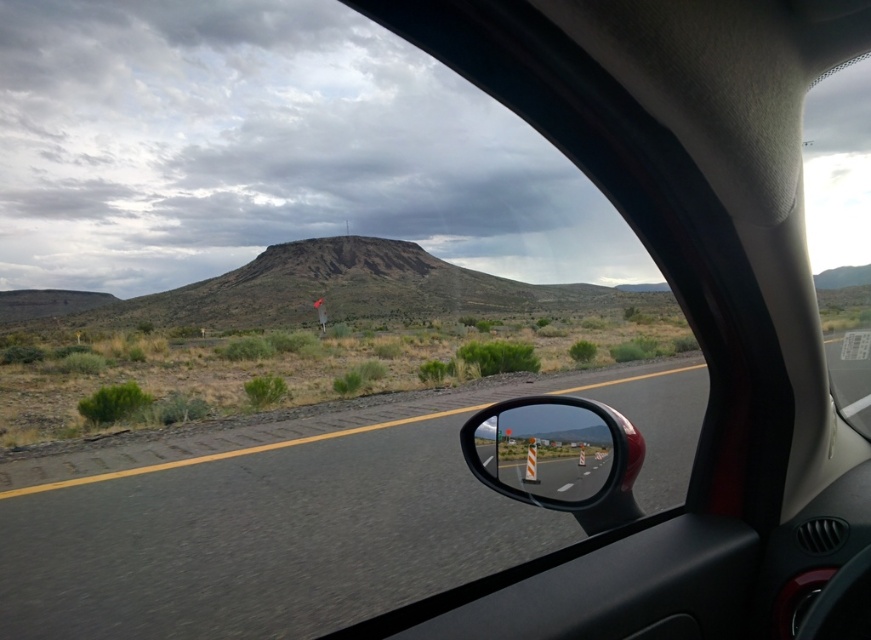
Does asphalt road at center have a smaller size compared to shiny chrome mirror at right?

Yes, asphalt road at center is smaller than shiny chrome mirror at right.

Which is above, asphalt road at center or shiny chrome mirror at right?

Positioned higher is shiny chrome mirror at right.

Between point (242, 598) and point (588, 500), which one is positioned behind?

Positioned behind is point (242, 598).

Identify the location of asphalt road at center. The width and height of the screenshot is (871, 640). [x=262, y=532].

Is point (544, 456) less distant than point (861, 272)?

That is True.

Can you confirm if shiny chrome mirror at right is smaller than transparent glass car window at upper right?

Indeed, shiny chrome mirror at right has a smaller size compared to transparent glass car window at upper right.

Does point (520, 435) lie in front of point (842, 106)?

Yes, point (520, 435) is closer to viewer.

Find the location of a particular element. The width and height of the screenshot is (871, 640). shiny chrome mirror at right is located at coordinates (552, 451).

Does asphalt road at center have a lesser height compared to transparent glass car window at upper right?

Indeed, asphalt road at center has a lesser height compared to transparent glass car window at upper right.

Between asphalt road at center and transparent glass car window at upper right, which one has more height?

Standing taller between the two is transparent glass car window at upper right.

Between point (383, 580) and point (826, 154), which one is positioned in front?

Point (383, 580)

Locate an element on the screen. asphalt road at center is located at coordinates (262, 532).